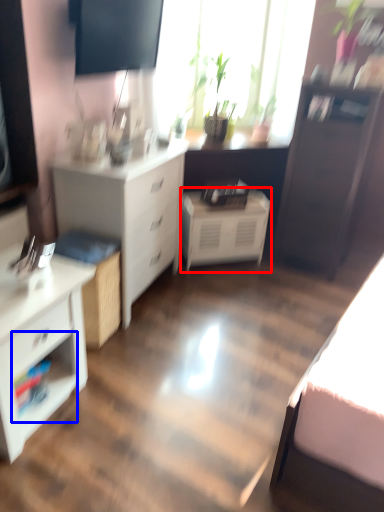
Question: Among these objects, which one is farthest to the camera, nightstand (highlighted by a red box) or shelf (highlighted by a blue box)?

Choices:
 (A) nightstand
 (B) shelf

Answer: (A)